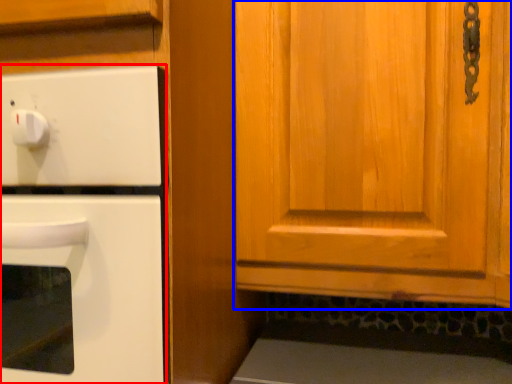
Question: Among these objects, which one is farthest to the camera, oven (highlighted by a red box) or cabinetry (highlighted by a blue box)?

Choices:
 (A) oven
 (B) cabinetry

Answer: (A)